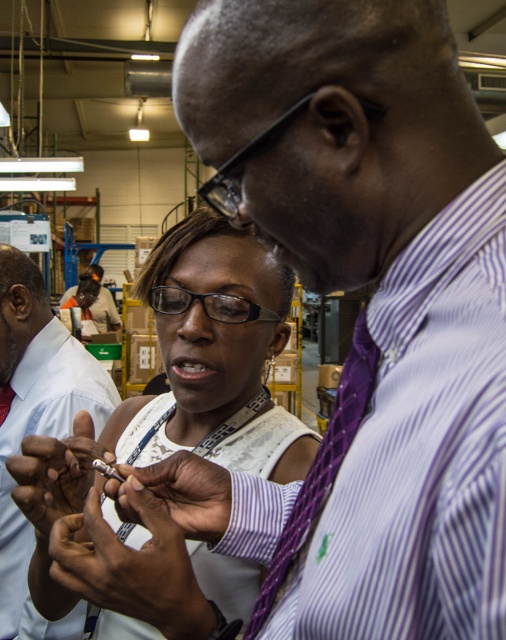
Question: Does purple striped shirt at center have a greater width compared to purple woven tie at center?

Choices:
 (A) yes
 (B) no

Answer: (A)

Question: Which point is farther from the camera taking this photo?

Choices:
 (A) (194, 486)
 (B) (88, 513)
 (C) (20, 522)

Answer: (C)

Question: Is purple striped shirt at center smaller than purple woven tie at center?

Choices:
 (A) no
 (B) yes

Answer: (A)

Question: Which point is closer to the camera taking this photo?

Choices:
 (A) (39, 412)
 (B) (186, 595)
 (C) (317, 467)
 (D) (64, 449)

Answer: (C)

Question: Is white fabric shirt at center above smooth skin hand at center?

Choices:
 (A) yes
 (B) no

Answer: (A)

Question: Estimate the real-world distances between objects in this image. Which object is closer to the purple striped shirt at center?

Choices:
 (A) metallic silver ring at center
 (B) matte silver pen at center

Answer: (B)